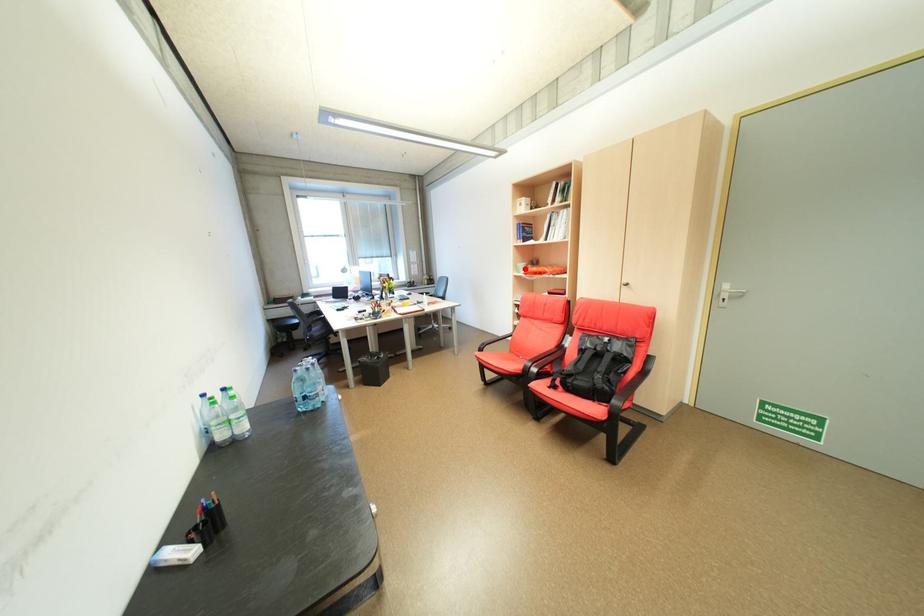
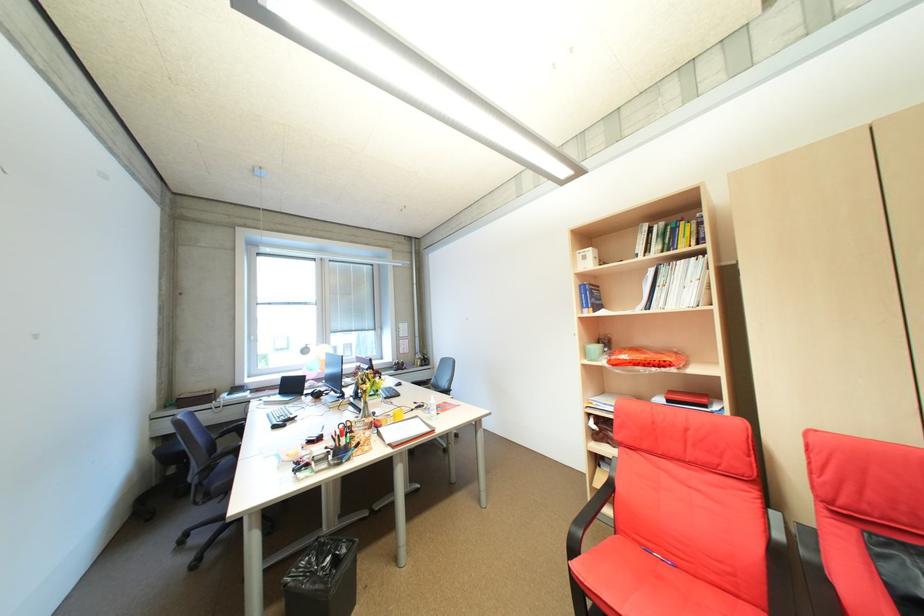
The point at the highlighted location is marked in the first image. Where is the corresponding point in the second image?

(593, 353)